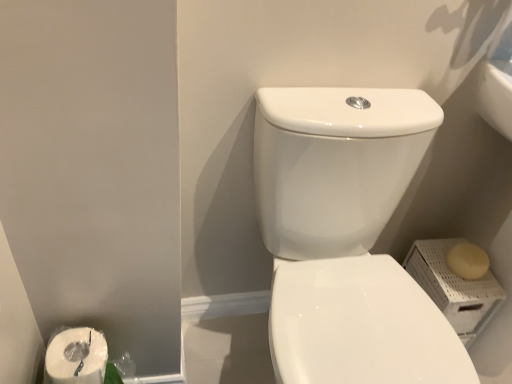
Question: From a real-world perspective, relative to white matte soap at right, is white glossy toilet at center vertically above or below?

Choices:
 (A) below
 (B) above

Answer: (B)

Question: In terms of size, does white glossy toilet at center appear bigger or smaller than white matte soap at right?

Choices:
 (A) big
 (B) small

Answer: (A)

Question: Would you say white glossy toilet at center is inside or outside white matte soap at right?

Choices:
 (A) outside
 (B) inside

Answer: (A)

Question: In the image, is white matte soap at right positioned in front of or behind white glossy toilet at center?

Choices:
 (A) behind
 (B) front

Answer: (A)

Question: From a real-world perspective, is white matte soap at right physically located above or below white glossy toilet at center?

Choices:
 (A) above
 (B) below

Answer: (B)

Question: Considering the positions of white matte soap at right and white glossy toilet at center in the image, is white matte soap at right wider or thinner than white glossy toilet at center?

Choices:
 (A) wide
 (B) thin

Answer: (B)

Question: Is white matte soap at right spatially inside white glossy toilet at center, or outside of it?

Choices:
 (A) inside
 (B) outside

Answer: (B)